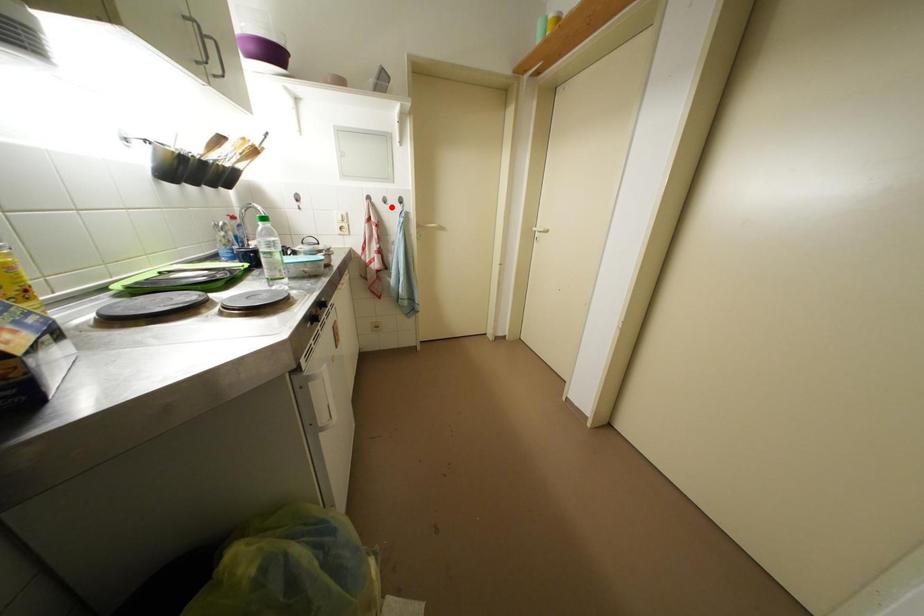
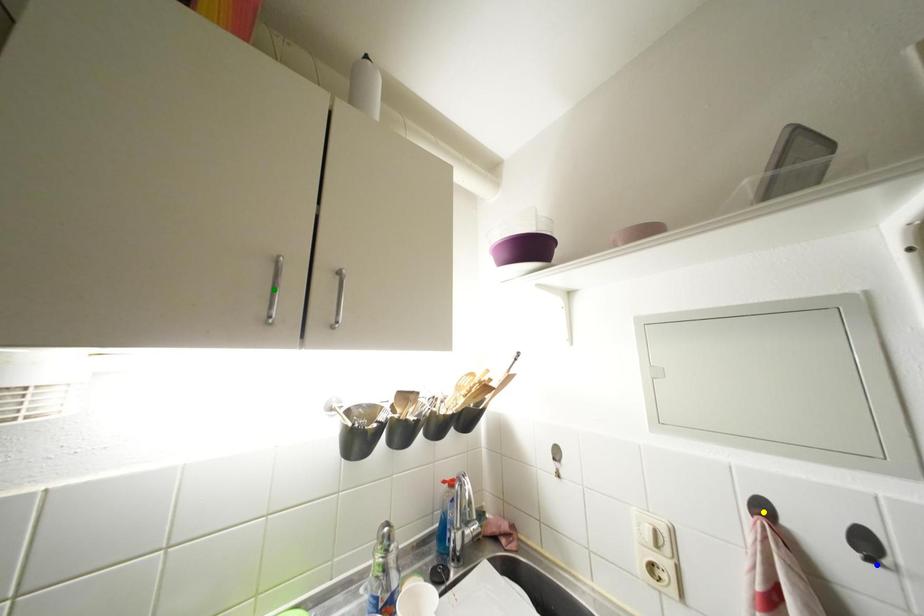
Question: I am providing you with two images of the same scene from different viewpoints. A red point is marked on the first image. You are given multiple points on the second image. Which point in image 2 is actually the same real-world point as the red point in image 1?

Choices:
 (A) green point
 (B) blue point
 (C) yellow point

Answer: (B)